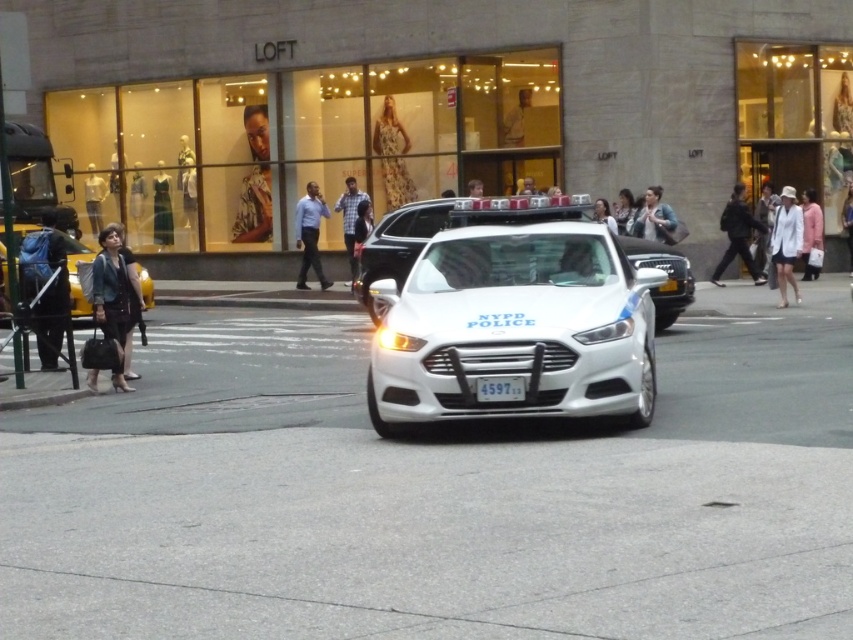
You are a delivery person who needs to place a matte black backpack at left exactly at the coordinates specified. What are the coordinates where you should place it?

The coordinates for placing the matte black backpack at left are point (45, 288).

You are a delivery person who needs to place a package on the floral dress at center and the matte black jacket at center. The delivery robot has a maximum reach distance of 5 meters. Can the robot place the package on both items without moving its position?

The floral dress at center is 5.75 meters away from the matte black jacket at center. Since the distance between them exceeds the robot s 5 meter reach, the robot cannot place the package on both items without moving its position.

You are a customer in a store and see two items at the center of the display. The floral dress at center and the leather jacket at center. Which item is placed higher?

The floral dress at center is positioned over the leather jacket at center, so it is placed higher.